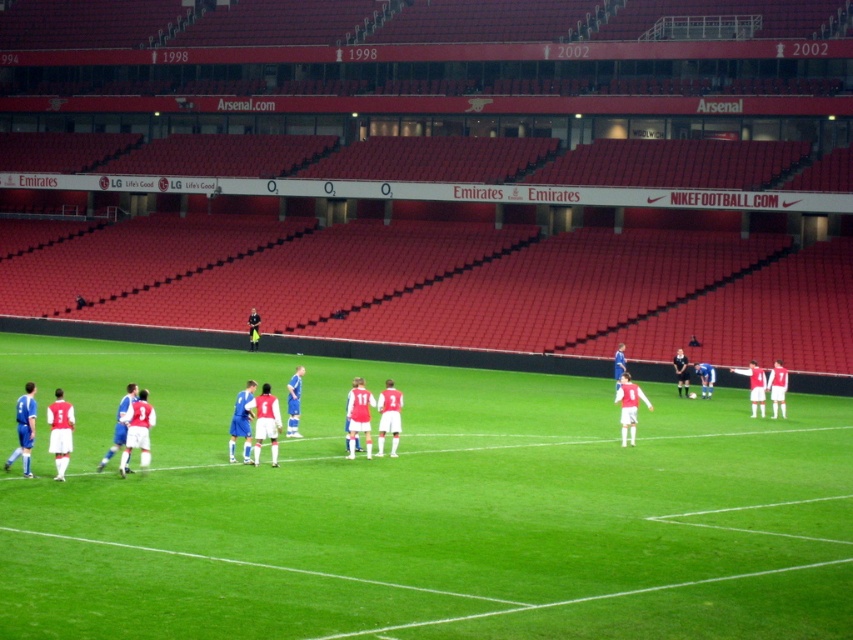
Based on the photo, you are a soccer ball placed at the edge of the green grass football field at center. You want to reach the matte red jersey at center. Considering your maximum rolling distance is 6 meters, can you reach the jersey without any external force?

The distance between the green grass football field at center and the matte red jersey at center is 6.45 meters. Since your maximum rolling distance is 6 meters, you cannot reach the jersey without external assistance.

You are a photographer positioned at the edge of the soccer field. You need to capture a photo where both the green grass football field at center and the matte red jersey at center are clearly visible. Considering their heights, which object will appear larger in the photo?

The green grass football field at center will appear larger in the photo because it is taller than the matte red jersey at center.

You are a photographer at the soccer match and want to capture a photo of the matte red jersey at center without the green grass football field at center appearing in the background. Is this possible based on their positions?

The green grass football field at center is positioned under the matte red jersey at center, so the jersey is in front of the field. This means the jersey would block the field from the background perspective, making it possible to take a photo of the matte red jersey at center without the green grass football field at center visible behind it.